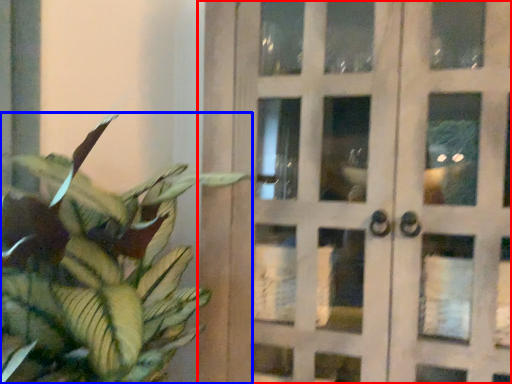
Question: Among these objects, which one is nearest to the camera, door (highlighted by a red box) or houseplant (highlighted by a blue box)?

Choices:
 (A) door
 (B) houseplant

Answer: (B)